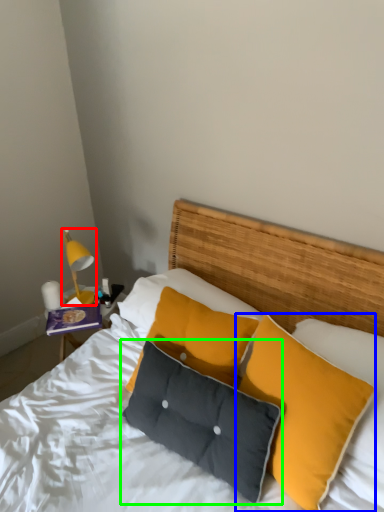
Question: Considering the real-world distances, which object is farthest from bedside lamp (highlighted by a red box)? pillow (highlighted by a blue box) or pillow (highlighted by a green box)?

Choices:
 (A) pillow
 (B) pillow

Answer: (A)